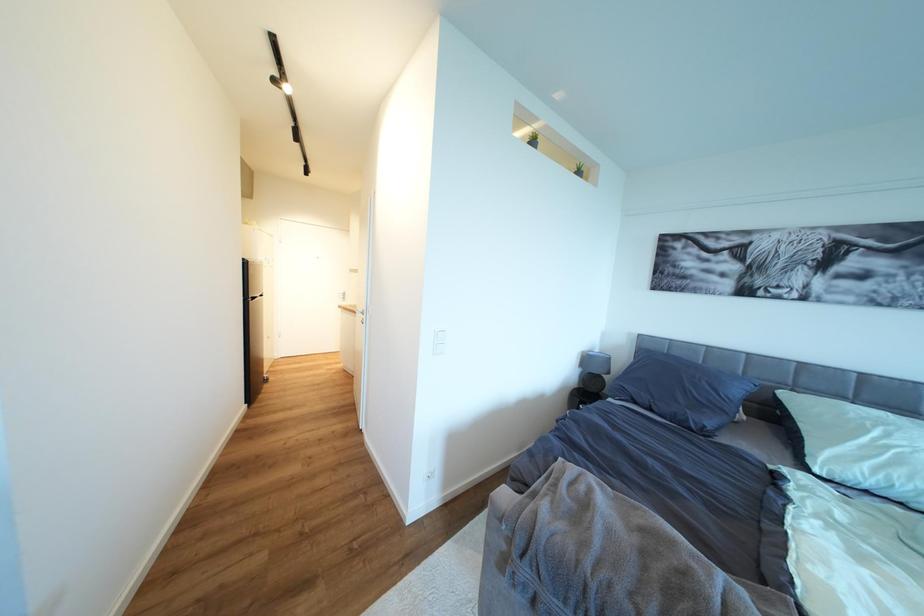
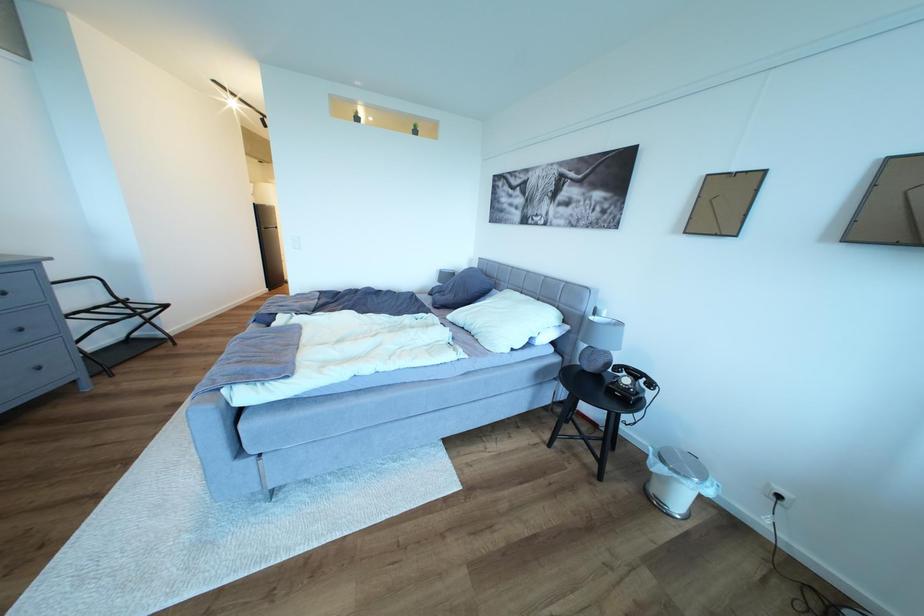
Question: In a continuous first-person perspective shot, in which direction is the camera moving?

Choices:
 (A) Left
 (B) Right
 (C) Forward
 (D) Backward

Answer: (B)